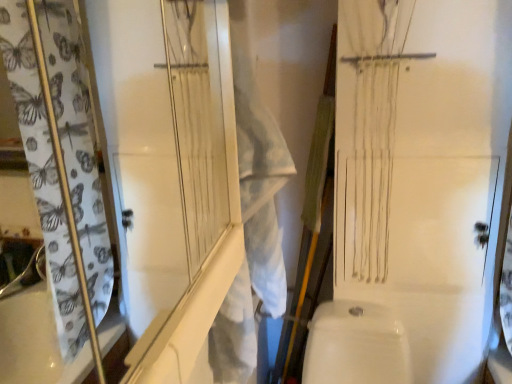
Describe the element at coordinates (252, 230) in the screenshot. I see `white fabric laundry at center` at that location.

Find the location of a particular element. The height and width of the screenshot is (384, 512). white glossy toilet bowl at lower center is located at coordinates (356, 345).

The image size is (512, 384). What do you see at coordinates (356, 345) in the screenshot? I see `white glossy toilet bowl at lower center` at bounding box center [356, 345].

What are the coordinates of `white textured screen door at upper left` in the screenshot? It's located at (170, 172).

Considering the relative sizes of white glossy toilet bowl at lower center and white fabric laundry at center in the image provided, is white glossy toilet bowl at lower center thinner than white fabric laundry at center?

No, white glossy toilet bowl at lower center is not thinner than white fabric laundry at center.

Where is `laundry located above the white glossy toilet bowl at lower center (from the image's perspective)`? laundry located above the white glossy toilet bowl at lower center (from the image's perspective) is located at coordinates (252, 230).

From the image's perspective, is white glossy toilet bowl at lower center below white fabric laundry at center?

Yes.

Is white glossy toilet bowl at lower center spatially inside white fabric laundry at center, or outside of it?

white glossy toilet bowl at lower center is outside white fabric laundry at center.

Can you confirm if white fabric laundry at center is bigger than white textured screen door at upper left?

Yes.

From the image's perspective, between white fabric laundry at center and white textured screen door at upper left, which one is located above?

white textured screen door at upper left is shown above in the image.

How different are the orientations of white fabric laundry at center and white textured screen door at upper left in degrees?

The angular difference between white fabric laundry at center and white textured screen door at upper left is 1.3 degrees.

Who is shorter, white fabric laundry at center or white textured screen door at upper left?

Standing shorter between the two is white textured screen door at upper left.

Where is `screen door that is above the white glossy toilet bowl at lower center (from the image's perspective)`? screen door that is above the white glossy toilet bowl at lower center (from the image's perspective) is located at coordinates (170, 172).

Considering the positions of objects white textured screen door at upper left and white glossy toilet bowl at lower center in the image provided, who is more to the left, white textured screen door at upper left or white glossy toilet bowl at lower center?

white textured screen door at upper left.

Could you tell me if white textured screen door at upper left is turned towards white glossy toilet bowl at lower center?

No, white textured screen door at upper left is not aimed at white glossy toilet bowl at lower center.

Based on the photo, from the image's perspective, which one is positioned higher, white textured screen door at upper left or white glossy toilet bowl at lower center?

From the image's view, white textured screen door at upper left is above.

Is white textured screen door at upper left not within white fabric laundry at center?

Absolutely, white textured screen door at upper left is external to white fabric laundry at center.

In order to click on screen door in front of the white fabric laundry at center in this screenshot , I will do `click(170, 172)`.

From a real-world perspective, who is located higher, white textured screen door at upper left or white fabric laundry at center?

white textured screen door at upper left is physically above.

Between white textured screen door at upper left and white fabric laundry at center, which one has smaller width?

white textured screen door at upper left.

What's the angular difference between white fabric laundry at center and white glossy toilet bowl at lower center's facing directions?

white fabric laundry at center and white glossy toilet bowl at lower center are facing 88.7 degrees away from each other.

Is white fabric laundry at center to the left or to the right of white glossy toilet bowl at lower center in the image?

Based on their positions, white fabric laundry at center is located to the left of white glossy toilet bowl at lower center.

Considering the positions of points (285, 292) and (351, 335), is point (285, 292) farther from camera compared to point (351, 335)?

No, (285, 292) is in front of (351, 335).

At what (x,y) coordinates should I click in order to perform the action: click on laundry above the white glossy toilet bowl at lower center (from a real-world perspective). Please return your answer as a coordinate pair (x, y). Image resolution: width=512 pixels, height=384 pixels. Looking at the image, I should click on (252, 230).

Relative to white textured screen door at upper left, is white glossy toilet bowl at lower center in front or behind?

In the image, white glossy toilet bowl at lower center appears behind white textured screen door at upper left.

Are white glossy toilet bowl at lower center and white textured screen door at upper left far apart?

No, white glossy toilet bowl at lower center is in close proximity to white textured screen door at upper left.

Considering the sizes of objects white glossy toilet bowl at lower center and white textured screen door at upper left in the image provided, who is bigger, white glossy toilet bowl at lower center or white textured screen door at upper left?

white glossy toilet bowl at lower center is bigger.

Locate an element on the screen. The width and height of the screenshot is (512, 384). laundry above the white glossy toilet bowl at lower center (from a real-world perspective) is located at coordinates (252, 230).

At what (x,y) coordinates should I click in order to perform the action: click on laundry below the white textured screen door at upper left (from a real-world perspective). Please return your answer as a coordinate pair (x, y). Looking at the image, I should click on (252, 230).

Looking at the image, which one is located further to white glossy toilet bowl at lower center, white fabric laundry at center or white textured screen door at upper left?

Based on the image, white textured screen door at upper left appears to be further to white glossy toilet bowl at lower center.

When comparing their distances from white fabric laundry at center, does white glossy toilet bowl at lower center or white textured screen door at upper left seem closer?

The object closer to white fabric laundry at center is white textured screen door at upper left.

When comparing their distances from white glossy toilet bowl at lower center, does white textured screen door at upper left or white fabric laundry at center seem closer?

white fabric laundry at center.

When comparing their distances from white fabric laundry at center, does white textured screen door at upper left or white glossy toilet bowl at lower center seem further?

The object further to white fabric laundry at center is white glossy toilet bowl at lower center.

Looking at the image, which one is located further to white textured screen door at upper left, white glossy toilet bowl at lower center or white fabric laundry at center?

white glossy toilet bowl at lower center lies further to white textured screen door at upper left than the other object.

Considering their positions, is white fabric laundry at center positioned closer to white textured screen door at upper left than white glossy toilet bowl at lower center?

Among the two, white fabric laundry at center is located nearer to white textured screen door at upper left.

Image resolution: width=512 pixels, height=384 pixels. I want to click on laundry located between white textured screen door at upper left and white glossy toilet bowl at lower center in the depth direction, so click(x=252, y=230).